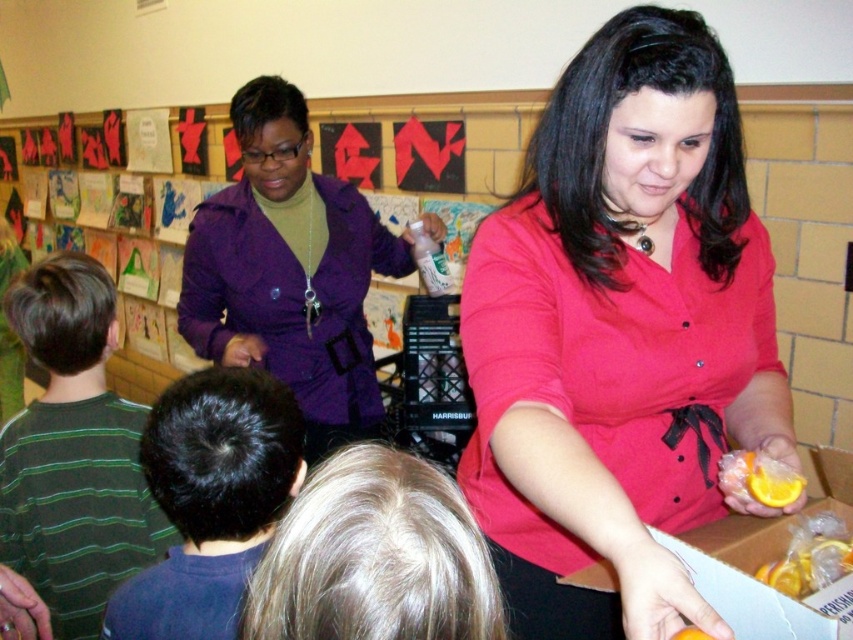
Is matte red blouse at center thinner than translucent plastic orange at lower right?

No.

Does matte red blouse at center have a larger size compared to translucent plastic orange at lower right?

Yes, matte red blouse at center is bigger than translucent plastic orange at lower right.

Image resolution: width=853 pixels, height=640 pixels. In order to click on matte red blouse at center in this screenshot , I will do `click(619, 333)`.

Between matte red blouse at center and dark brown hair at back, which one appears on the right side from the viewer's perspective?

matte red blouse at center is more to the right.

Find the location of `matte red blouse at center`. matte red blouse at center is located at coordinates (619, 333).

In order to click on matte red blouse at center in this screenshot , I will do `click(619, 333)`.

Is purple matte jacket at upper left to the right of white cardboard box at lower right from the viewer's perspective?

No, purple matte jacket at upper left is not to the right of white cardboard box at lower right.

The width and height of the screenshot is (853, 640). Describe the element at coordinates (289, 269) in the screenshot. I see `purple matte jacket at upper left` at that location.

I want to click on purple matte jacket at upper left, so click(289, 269).